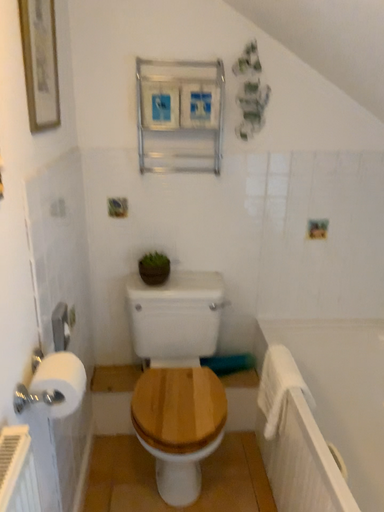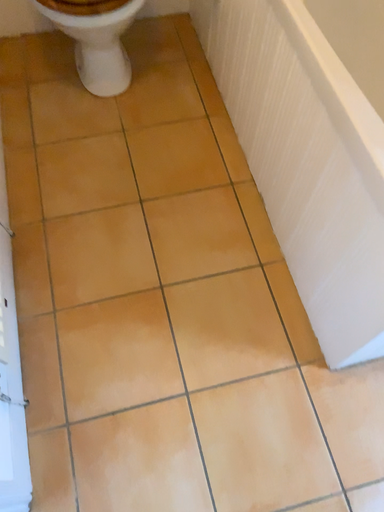
Question: How did the camera likely rotate when shooting the video?

Choices:
 (A) rotated left
 (B) rotated right

Answer: (B)